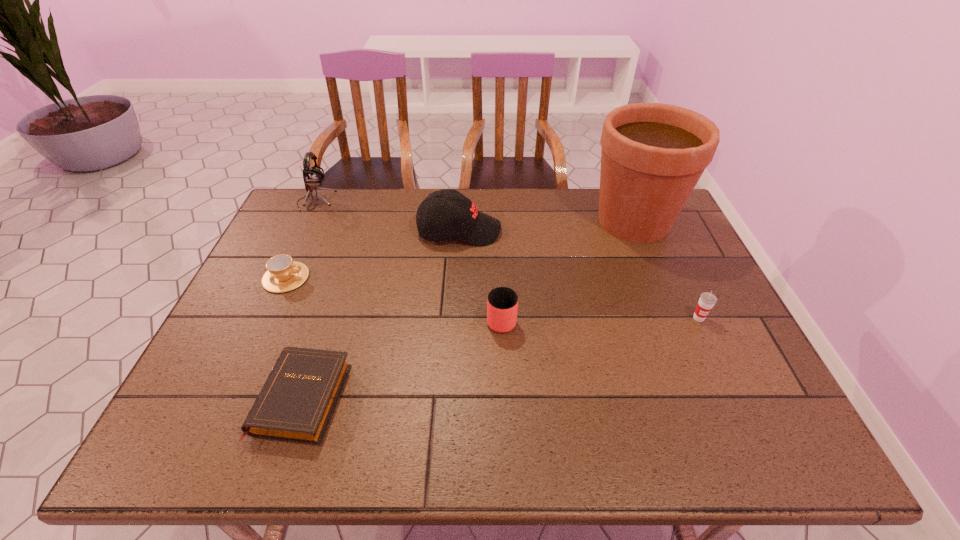
Image resolution: width=960 pixels, height=540 pixels. I want to click on free spot between the second cup from right to left and the Bible, so click(x=402, y=359).

At what (x,y) coordinates should I click in order to perform the action: click on vacant area between the rightmost cup and the second cup from right to left. Please return your answer as a coordinate pair (x, y). This screenshot has height=540, width=960. Looking at the image, I should click on (600, 318).

You are a GUI agent. You are given a task and a screenshot of the screen. Output one action in this format:
    pyautogui.click(x=<x>, y=<y>)
    Task: Click on the object that is the fourth closest to the rightmost cup
    Image resolution: width=960 pixels, height=540 pixels.
    Given the screenshot: What is the action you would take?
    pyautogui.click(x=296, y=404)

The height and width of the screenshot is (540, 960). I want to click on object that is the third closest one to the Bible, so click(x=460, y=218).

Image resolution: width=960 pixels, height=540 pixels. What are the coordinates of `cup that is the closest to the fifth shortest object` in the screenshot? It's located at (502, 303).

The image size is (960, 540). Find the location of `cup that is the second closest one to the shortest cup`. cup that is the second closest one to the shortest cup is located at coordinates (707, 300).

This screenshot has height=540, width=960. Find the location of `free location that satisfies the following two spatial constraints: 1. on the handle side of the second cup from left to right; 2. on the front-facing side of the baseball cap`. free location that satisfies the following two spatial constraints: 1. on the handle side of the second cup from left to right; 2. on the front-facing side of the baseball cap is located at coordinates (497, 231).